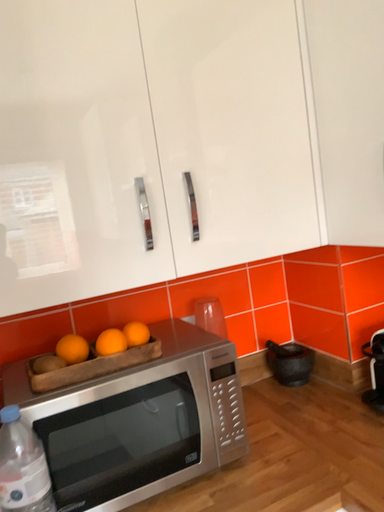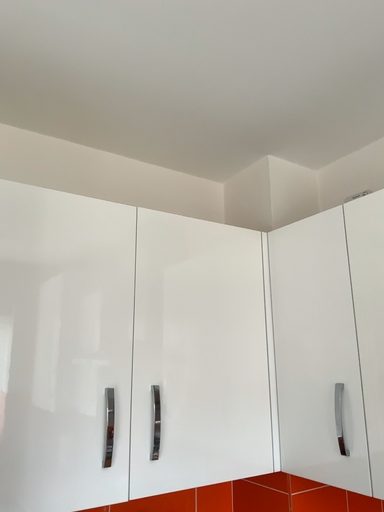
Question: Which way did the camera rotate in the video?

Choices:
 (A) rotated upward
 (B) rotated downward

Answer: (A)